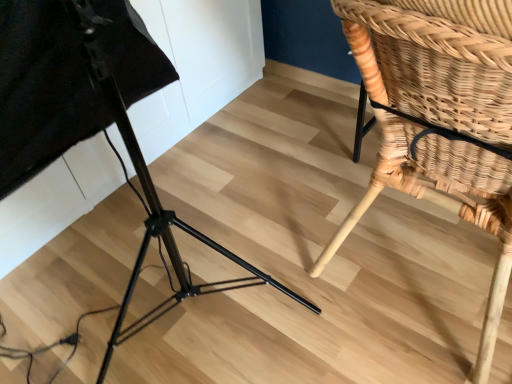
Question: Is woven wood chair at lower right in front of or behind black metal tripod at lower left in the image?

Choices:
 (A) front
 (B) behind

Answer: (B)

Question: Considering the relative positions of woven wood chair at lower right and black metal tripod at lower left in the image provided, is woven wood chair at lower right to the left or to the right of black metal tripod at lower left?

Choices:
 (A) right
 (B) left

Answer: (A)

Question: In terms of height, does woven wood chair at lower right look taller or shorter compared to black metal tripod at lower left?

Choices:
 (A) tall
 (B) short

Answer: (B)

Question: Looking at the image, does black metal tripod at lower left seem bigger or smaller compared to woven wood chair at lower right?

Choices:
 (A) big
 (B) small

Answer: (A)

Question: From the image's perspective, relative to woven wood chair at lower right, is black metal tripod at lower left above or below?

Choices:
 (A) below
 (B) above

Answer: (A)

Question: From a real-world perspective, is black metal tripod at lower left positioned above or below woven wood chair at lower right?

Choices:
 (A) above
 (B) below

Answer: (A)

Question: Is point (74, 16) closer or farther from the camera than point (476, 130)?

Choices:
 (A) farther
 (B) closer

Answer: (B)